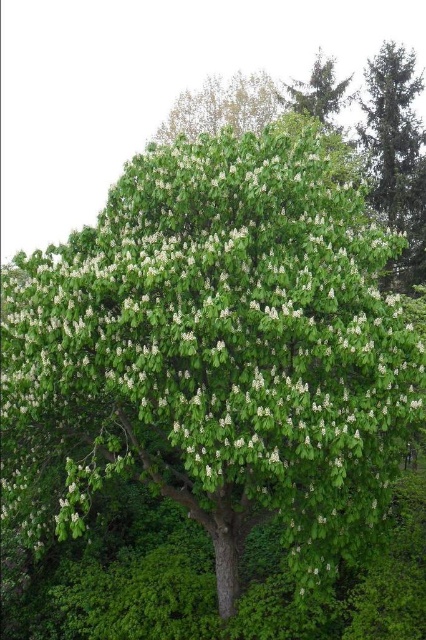
You are standing in a forest and want to take a photo of both the green matte tree at upper right and the green leafy tree at upper center. Which tree should you focus on first to ensure both are in sharp focus?

You should focus on the green leafy tree at upper center first because it is farther away from the viewer than the green matte tree at upper right, ensuring both will be in focus when focusing on the farther one.

You are standing at the camera position and want to take a photo of the green matte tree at upper right. If your camera has a maximum focus range of 50 feet, will you be able to capture the tree in focus?

The green matte tree at upper right and camera are 46.97 feet apart. Since 46.97 feet is within the camera maximum focus range of 50 feet, the camera can focus on the green matte tree at upper right.